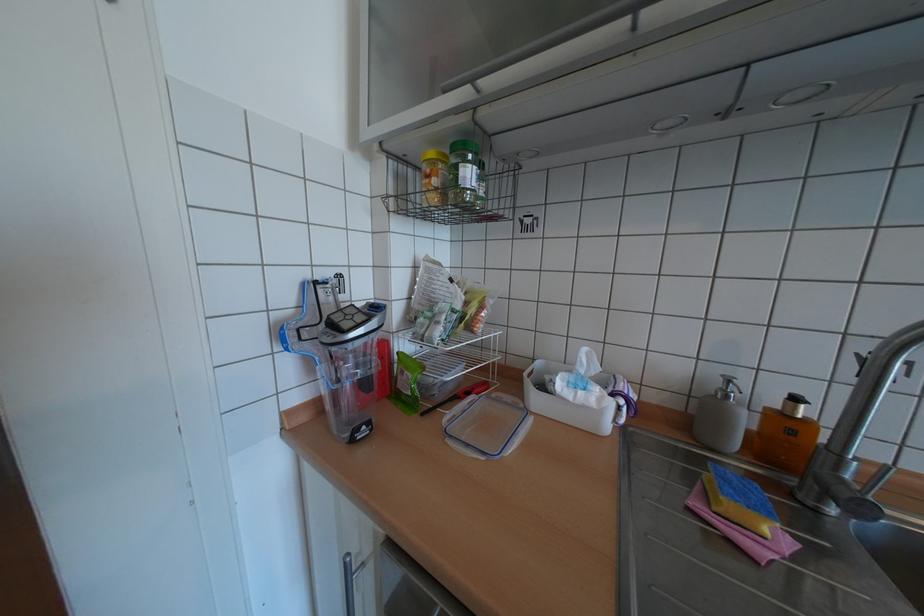
Locate an element on the screen. upper cabinet handle is located at coordinates (548, 42).